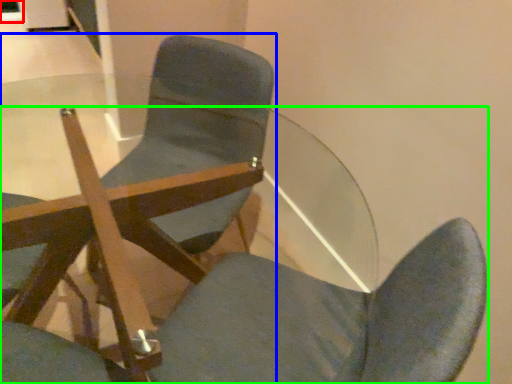
Question: Based on their relative distances, which object is farther from glass door (highlighted by a red box)? Choose from chair (highlighted by a blue box) and chair (highlighted by a green box).

Choices:
 (A) chair
 (B) chair

Answer: (B)